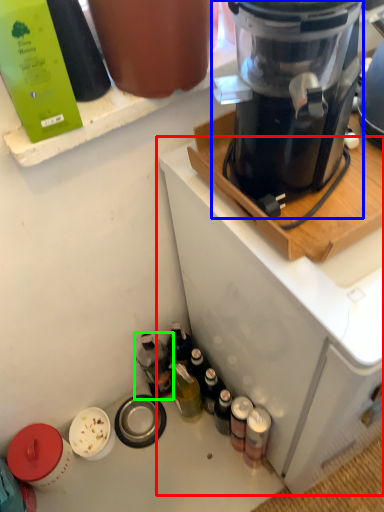
Question: Which is farther away from home appliance (highlighted by a red box)? blender (highlighted by a blue box) or bottle (highlighted by a green box)?

Choices:
 (A) blender
 (B) bottle

Answer: (B)